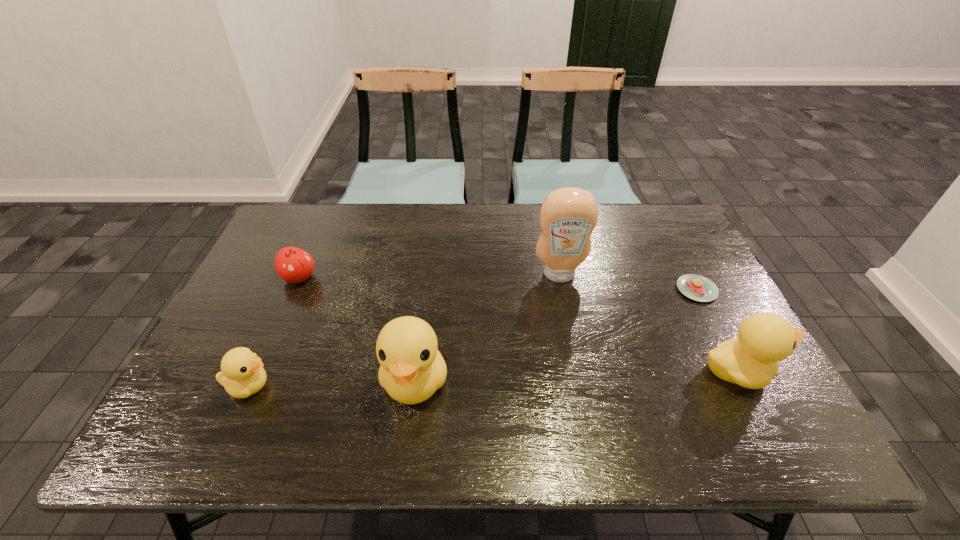
Where is `free space for an extra duck to achieve even spacing`? The image size is (960, 540). free space for an extra duck to achieve even spacing is located at coordinates (578, 376).